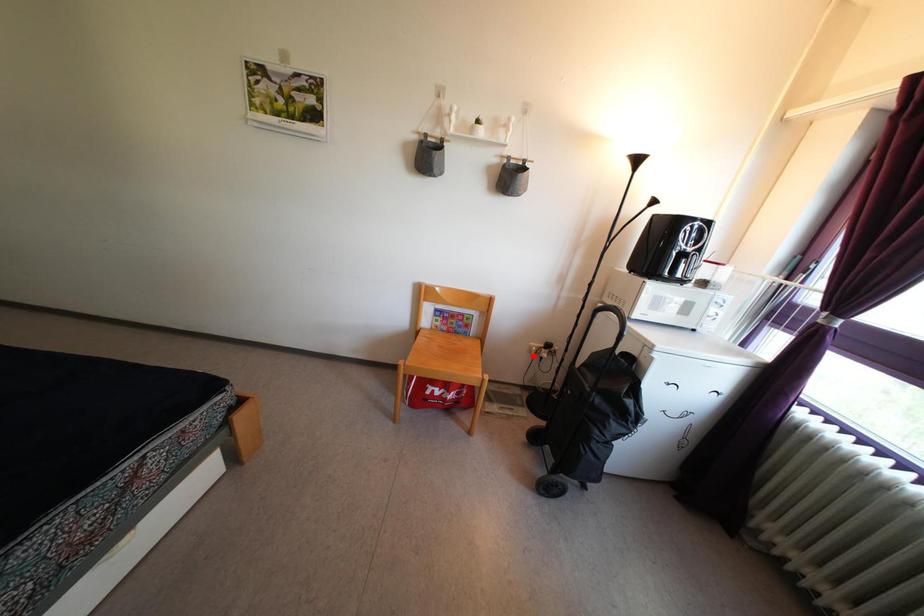
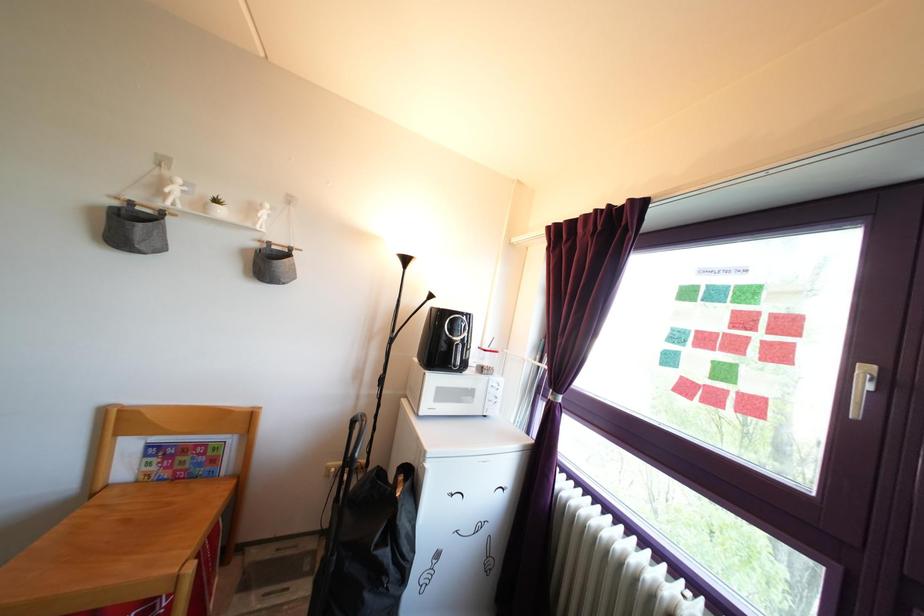
Find the pixel in the second image that matches the highlighted location in the first image.

(332, 477)